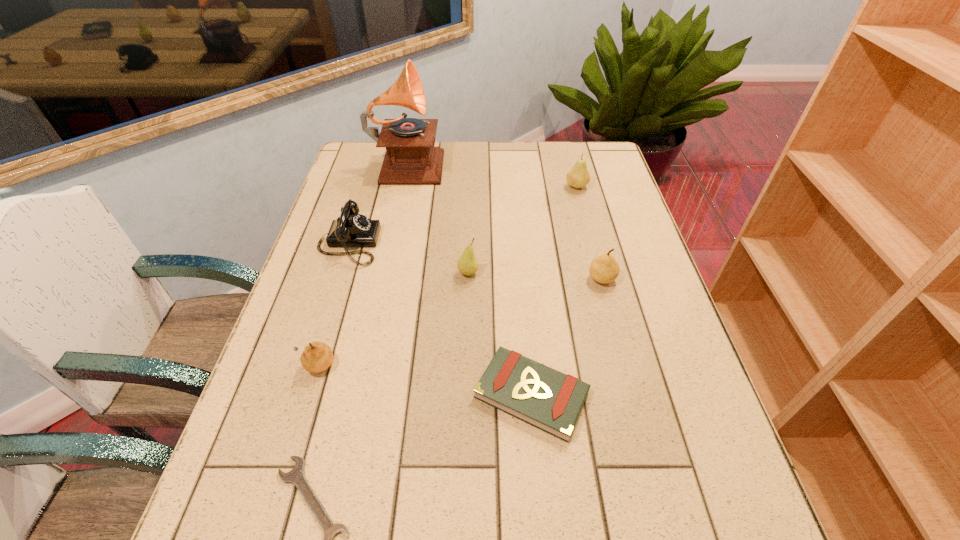
Locate an element on the screen. phonograph record is located at coordinates (411, 158).

Locate an element on the screen. the farthest pear is located at coordinates [578, 176].

The height and width of the screenshot is (540, 960). In order to click on the third pear from right to left in this screenshot , I will do `click(467, 264)`.

This screenshot has height=540, width=960. In order to click on telephone in this screenshot , I will do `click(351, 229)`.

Identify the location of the leftmost pear. (317, 356).

In order to click on the nearest pear in this screenshot , I will do `click(317, 356)`.

Find the location of a particular element. The image size is (960, 540). book is located at coordinates (545, 398).

Locate an element on the screen. free spot located on the horn of the phonograph record is located at coordinates (561, 161).

Where is `vacant space positioned 0.130m on the back of the farthest pear`? This screenshot has width=960, height=540. vacant space positioned 0.130m on the back of the farthest pear is located at coordinates (569, 158).

Where is `vacant space situated on the right of the third pear from right to left`? The height and width of the screenshot is (540, 960). vacant space situated on the right of the third pear from right to left is located at coordinates (595, 273).